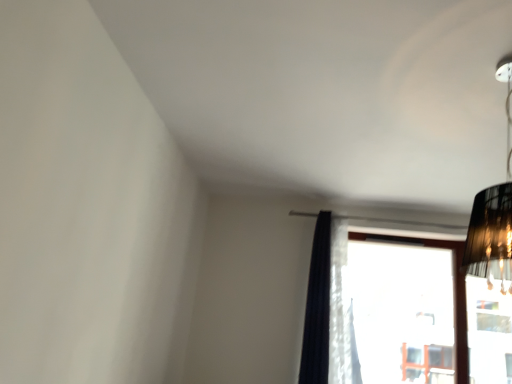
Question: Is dark blue sheer curtain at center thinner than transparent glass window at center?

Choices:
 (A) no
 (B) yes

Answer: (A)

Question: Is dark blue sheer curtain at center wider than transparent glass window at center?

Choices:
 (A) yes
 (B) no

Answer: (A)

Question: Is dark blue sheer curtain at center completely or partially outside of transparent glass window at center?

Choices:
 (A) yes
 (B) no

Answer: (A)

Question: Can you confirm if dark blue sheer curtain at center is positioned to the left of transparent glass window at center?

Choices:
 (A) yes
 (B) no

Answer: (A)

Question: Can you confirm if dark blue sheer curtain at center is positioned to the right of transparent glass window at center?

Choices:
 (A) yes
 (B) no

Answer: (B)

Question: In terms of width, does dark blue sheer curtain at center look wider or thinner when compared to black fabric lampshade at upper right?

Choices:
 (A) wide
 (B) thin

Answer: (B)

Question: From a real-world perspective, is dark blue sheer curtain at center above or below black fabric lampshade at upper right?

Choices:
 (A) below
 (B) above

Answer: (A)

Question: From the image's perspective, is dark blue sheer curtain at center located above or below black fabric lampshade at upper right?

Choices:
 (A) below
 (B) above

Answer: (A)

Question: Relative to black fabric lampshade at upper right, is dark blue sheer curtain at center in front or behind?

Choices:
 (A) behind
 (B) front

Answer: (A)

Question: Is dark blue sheer curtain at center bigger or smaller than transparent glass window at center?

Choices:
 (A) big
 (B) small

Answer: (B)

Question: Looking at their shapes, would you say dark blue sheer curtain at center is wider or thinner than transparent glass window at center?

Choices:
 (A) thin
 (B) wide

Answer: (B)

Question: From the image's perspective, is dark blue sheer curtain at center above or below transparent glass window at center?

Choices:
 (A) above
 (B) below

Answer: (A)

Question: Is dark blue sheer curtain at center situated inside transparent glass window at center or outside?

Choices:
 (A) outside
 (B) inside

Answer: (A)

Question: Visually, is black fabric lampshade at upper right positioned to the left or to the right of transparent glass window at center?

Choices:
 (A) left
 (B) right

Answer: (A)

Question: Considering the positions of point (480, 218) and point (379, 375), is point (480, 218) closer or farther from the camera than point (379, 375)?

Choices:
 (A) closer
 (B) farther

Answer: (A)